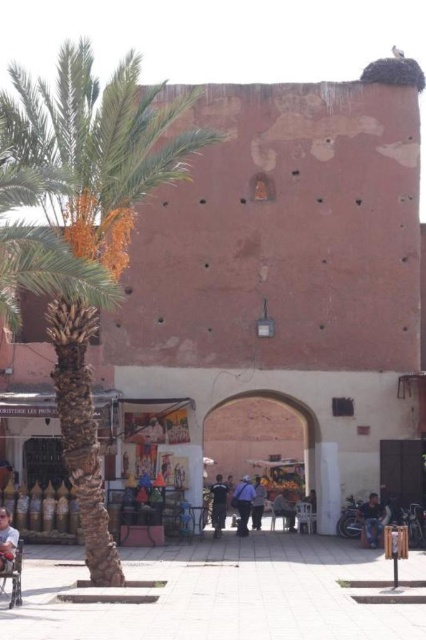
Is brick archway at center positioned behind dark blue uniform at center?

No, it is not.

Does brick archway at center have a greater height compared to dark blue uniform at center?

Yes.

What do you see at coordinates (259, 440) in the screenshot? I see `brick archway at center` at bounding box center [259, 440].

This screenshot has width=426, height=640. What are the coordinates of `brick archway at center` in the screenshot? It's located at (259, 440).

Is brick archway at center above dark blue jeans at center?

Yes.

Is brick archway at center to the left of dark blue jeans at center from the viewer's perspective?

Yes, brick archway at center is to the left of dark blue jeans at center.

Between point (290, 420) and point (281, 499), which one is positioned behind?

The point (290, 420) is more distant.

This screenshot has width=426, height=640. I want to click on brick archway at center, so click(259, 440).

Based on the photo, which is more to the left, brick archway at center or jeans at center?

Positioned to the left is brick archway at center.

Who is taller, brick archway at center or jeans at center?

Standing taller between the two is brick archway at center.

Which is in front, point (267, 440) or point (379, 502)?

Point (379, 502) is more forward.

The width and height of the screenshot is (426, 640). Find the location of `brick archway at center`. brick archway at center is located at coordinates (259, 440).